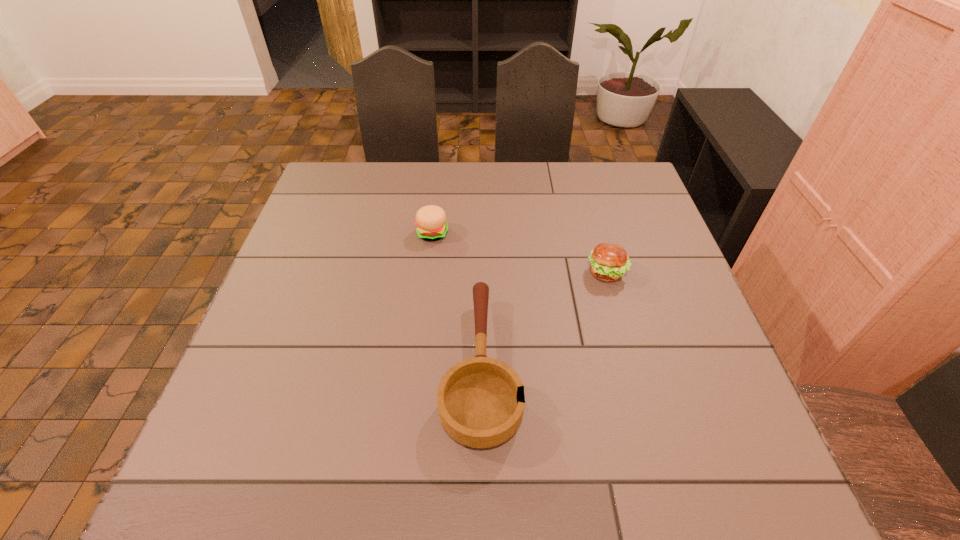
Where is `vacant space in between the saucepan and the rightmost object`? vacant space in between the saucepan and the rightmost object is located at coordinates (543, 320).

Identify the location of vacant area that lies between the rightmost object and the leftmost object. The image size is (960, 540). (519, 253).

Identify the location of free space between the second object from right to left and the rightmost object. This screenshot has height=540, width=960. (543, 320).

You are a GUI agent. You are given a task and a screenshot of the screen. Output one action in this format:
    pyautogui.click(x=<x>, y=<y>)
    Task: Click on the vacant area that lies between the right hamburger and the saucepan
    The height and width of the screenshot is (540, 960).
    Given the screenshot: What is the action you would take?
    pyautogui.click(x=543, y=320)

Identify the location of vacant space that's between the second farthest object and the nearest object. The image size is (960, 540). (543, 320).

At what (x,y) coordinates should I click in order to perform the action: click on blank region between the nearer hamburger and the saucepan. Please return your answer as a coordinate pair (x, y). Image resolution: width=960 pixels, height=540 pixels. Looking at the image, I should click on (543, 320).

Identify the location of free space between the nearest object and the farther hamburger. (457, 300).

Identify the location of vacant space that is in between the nearest object and the right hamburger. The width and height of the screenshot is (960, 540). (543, 320).

The width and height of the screenshot is (960, 540). Find the location of `free area in between the second object from left to right and the rightmost object`. free area in between the second object from left to right and the rightmost object is located at coordinates (543, 320).

Where is `the closest object to the left hamburger`? Image resolution: width=960 pixels, height=540 pixels. the closest object to the left hamburger is located at coordinates (481, 401).